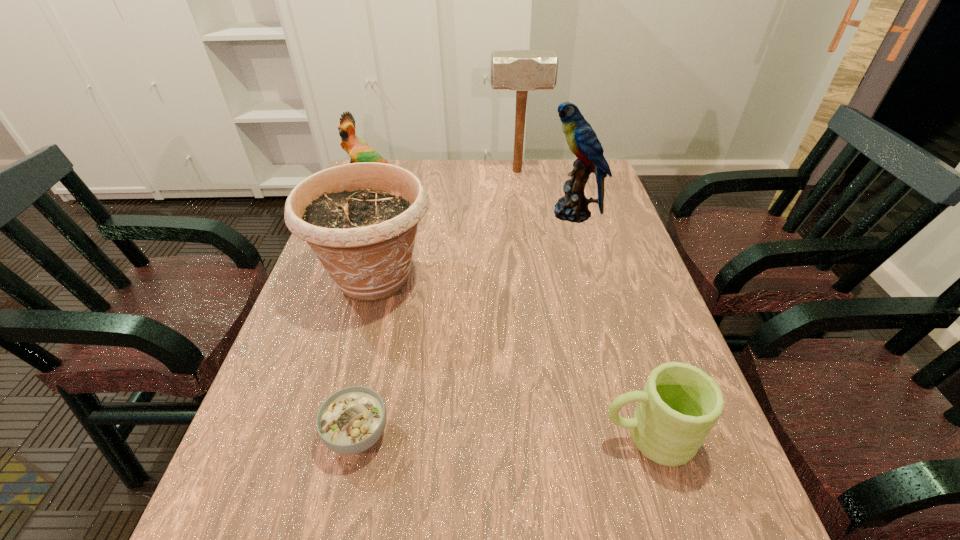
Where is `free space between the mug and the mallet`? The image size is (960, 540). free space between the mug and the mallet is located at coordinates (583, 303).

Locate an element on the screen. This screenshot has height=540, width=960. free space that is in between the farthest object and the fourth farthest object is located at coordinates (445, 225).

Locate which object is the fifth closest to the shortest object. Please provide its 2D coordinates. Your answer should be formatted as a tuple, i.e. [(x, y)], where the tuple contains the x and y coordinates of a point satisfying the conditions above.

[(521, 70)]

Select which object is the second closest to the soup bowl. Please provide its 2D coordinates. Your answer should be formatted as a tuple, i.e. [(x, y)], where the tuple contains the x and y coordinates of a point satisfying the conditions above.

[(680, 403)]

This screenshot has width=960, height=540. What are the coordinates of `free space that satisfies the following two spatial constraints: 1. on the striking face of the farthest object; 2. on the front side of the flowerpot` in the screenshot? It's located at (531, 278).

Identify the location of free space that satisfies the following two spatial constraints: 1. on the front side of the fourth farthest object; 2. on the right side of the soup bowl. (332, 434).

Where is `vacant position in the image that satisfies the following two spatial constraints: 1. on the front side of the flowerpot; 2. on the left side of the shortest object`? The image size is (960, 540). vacant position in the image that satisfies the following two spatial constraints: 1. on the front side of the flowerpot; 2. on the left side of the shortest object is located at coordinates click(x=332, y=434).

Identify the location of vacant space that satisfies the following two spatial constraints: 1. on the front-facing side of the left parrot; 2. on the left side of the third nearest object. The width and height of the screenshot is (960, 540). (341, 278).